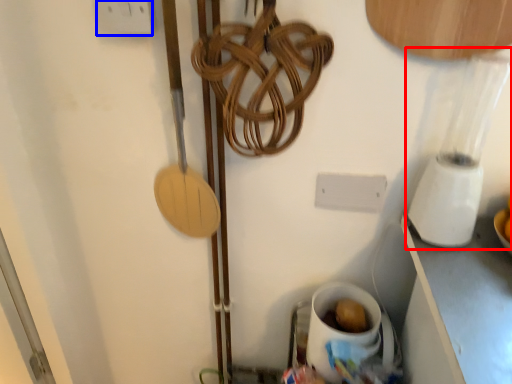
Question: Which of the following is the closest to the observer, blender (highlighted by a red box) or electric outlet (highlighted by a blue box)?

Choices:
 (A) blender
 (B) electric outlet

Answer: (A)